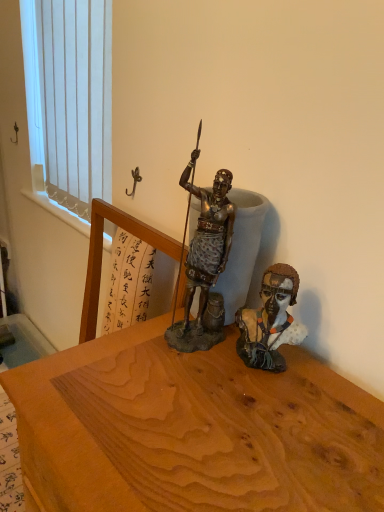
Question: Do you think matte brown bust at center right is within white vertical blinds at upper left, or outside of it?

Choices:
 (A) inside
 (B) outside

Answer: (B)

Question: Does point (266, 300) appear closer or farther from the camera than point (64, 108)?

Choices:
 (A) closer
 (B) farther

Answer: (A)

Question: From a real-world perspective, is matte brown bust at center right physically located above or below white vertical blinds at upper left?

Choices:
 (A) above
 (B) below

Answer: (B)

Question: Is white vertical blinds at upper left situated inside matte brown bust at center right or outside?

Choices:
 (A) inside
 (B) outside

Answer: (B)

Question: From the image's perspective, is white vertical blinds at upper left positioned above or below matte brown bust at center right?

Choices:
 (A) above
 (B) below

Answer: (A)

Question: From a real-world perspective, is white vertical blinds at upper left positioned above or below matte brown bust at center right?

Choices:
 (A) below
 (B) above

Answer: (B)

Question: Looking at the image, does white vertical blinds at upper left seem bigger or smaller compared to matte brown bust at center right?

Choices:
 (A) big
 (B) small

Answer: (A)